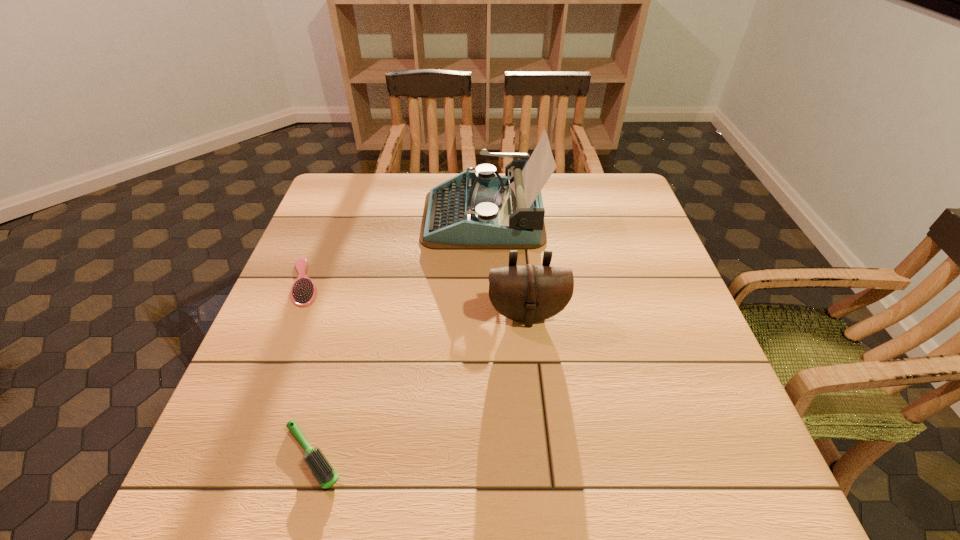
Where is `free space between the pouch and the taller hairbrush`? free space between the pouch and the taller hairbrush is located at coordinates (420, 384).

You are a GUI agent. You are given a task and a screenshot of the screen. Output one action in this format:
    pyautogui.click(x=<x>, y=<y>)
    Task: Click on the object that is the third nearest to the nearest object
    The width and height of the screenshot is (960, 540).
    Given the screenshot: What is the action you would take?
    (x=482, y=210)

The width and height of the screenshot is (960, 540). I want to click on object that is the third closest to the typewriter, so (x=326, y=476).

You are a GUI agent. You are given a task and a screenshot of the screen. Output one action in this format:
    pyautogui.click(x=<x>, y=<y>)
    Task: Click on the free space in the image that satisfies the following two spatial constraints: 1. on the typing side of the typewriter; 2. on the front side of the shorter hairbrush
    Image resolution: width=960 pixels, height=540 pixels.
    Given the screenshot: What is the action you would take?
    pyautogui.click(x=484, y=282)

Locate an element on the screen. vacant space that satisfies the following two spatial constraints: 1. on the typing side of the tallest object; 2. on the front side of the nearest object is located at coordinates 486,455.